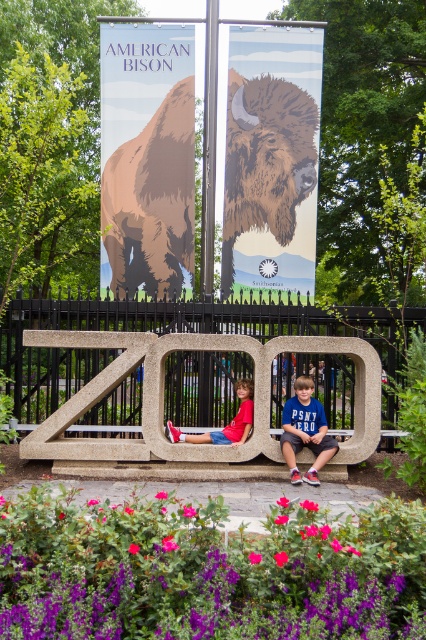
Question: Which point is farther to the camera?

Choices:
 (A) (291, 365)
 (B) (275, 120)
 (C) (216, 438)
 (D) (307, 442)

Answer: (B)

Question: Does matte brown bison at upper left have a lesser width compared to granite bench at center?

Choices:
 (A) yes
 (B) no

Answer: (A)

Question: Among these objects, which one is farthest from the camera?

Choices:
 (A) matte brown bison at upper left
 (B) brown textured bison at center
 (C) matte blue shirt at center

Answer: (A)

Question: From the image, what is the correct spatial relationship of granite bench at center in relation to brown paper-like at upper center?

Choices:
 (A) left
 (B) right

Answer: (A)

Question: Among these objects, which one is farthest from the camera?

Choices:
 (A) matte brown bison at upper left
 (B) brown textured bison at center

Answer: (A)

Question: In this image, where is blue cotton shirt at center located relative to matte blue shirt at center?

Choices:
 (A) below
 (B) above

Answer: (A)